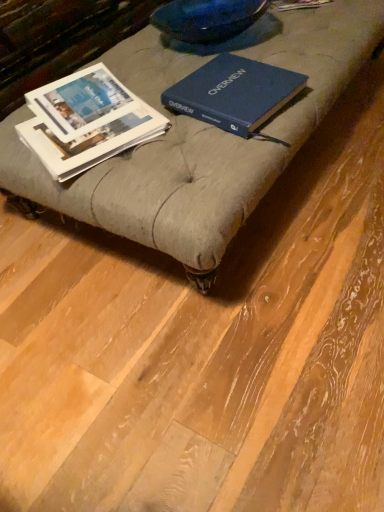
Question: Can you confirm if blue hardcover book at center, the second book when ordered from left to right, is bigger than matte gray ottoman at center?

Choices:
 (A) yes
 (B) no

Answer: (B)

Question: Is blue hardcover book at center, the second book when ordered from left to right, oriented away from matte gray ottoman at center?

Choices:
 (A) yes
 (B) no

Answer: (B)

Question: Does blue hardcover book at center, marked as the 1th book in a right-to-left arrangement, have a lesser height compared to matte gray ottoman at center?

Choices:
 (A) no
 (B) yes

Answer: (A)

Question: From a real-world perspective, is blue hardcover book at center, the second book when ordered from left to right, physically below matte gray ottoman at center?

Choices:
 (A) yes
 (B) no

Answer: (B)

Question: From a real-world perspective, is blue hardcover book at center, marked as the 1th book in a right-to-left arrangement, on top of matte gray ottoman at center?

Choices:
 (A) yes
 (B) no

Answer: (A)

Question: Can you confirm if blue hardcover book at center, the second book when ordered from left to right, is positioned to the left of matte gray ottoman at center?

Choices:
 (A) no
 (B) yes

Answer: (A)

Question: From a real-world perspective, is white paper book at left, the 2th book viewed from the right, under blue hardcover book at center, the second book when ordered from left to right?

Choices:
 (A) yes
 (B) no

Answer: (A)

Question: Could you tell me if white paper book at left, the 2th book viewed from the right, is facing blue hardcover book at center, marked as the 1th book in a right-to-left arrangement?

Choices:
 (A) yes
 (B) no

Answer: (A)

Question: From a real-world perspective, does white paper book at left, the 2th book viewed from the right, stand above blue hardcover book at center, marked as the 1th book in a right-to-left arrangement?

Choices:
 (A) yes
 (B) no

Answer: (B)

Question: Does white paper book at left, which appears as the 1th book when viewed from the left, have a larger size compared to blue hardcover book at center, the second book when ordered from left to right?

Choices:
 (A) yes
 (B) no

Answer: (B)

Question: Considering the relative positions of white paper book at left, which appears as the 1th book when viewed from the left, and blue hardcover book at center, marked as the 1th book in a right-to-left arrangement, in the image provided, is white paper book at left, which appears as the 1th book when viewed from the left, behind blue hardcover book at center, marked as the 1th book in a right-to-left arrangement,?

Choices:
 (A) no
 (B) yes

Answer: (A)

Question: Is white paper book at left, which appears as the 1th book when viewed from the left, in front of blue hardcover book at center, the second book when ordered from left to right?

Choices:
 (A) no
 (B) yes

Answer: (B)

Question: Is white paper book at left, the 2th book viewed from the right, completely or partially inside blue hardcover book at center, marked as the 1th book in a right-to-left arrangement?

Choices:
 (A) no
 (B) yes

Answer: (A)